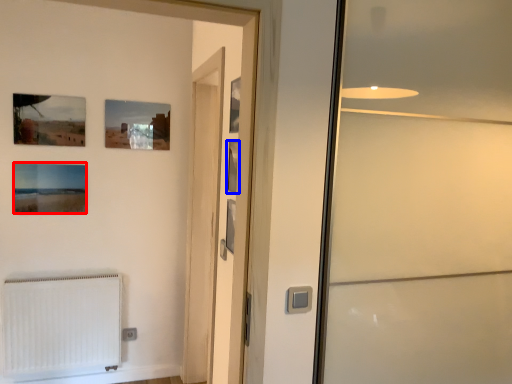
Question: Among these objects, which one is farthest to the camera, picture frame (highlighted by a red box) or picture frame (highlighted by a blue box)?

Choices:
 (A) picture frame
 (B) picture frame

Answer: (A)